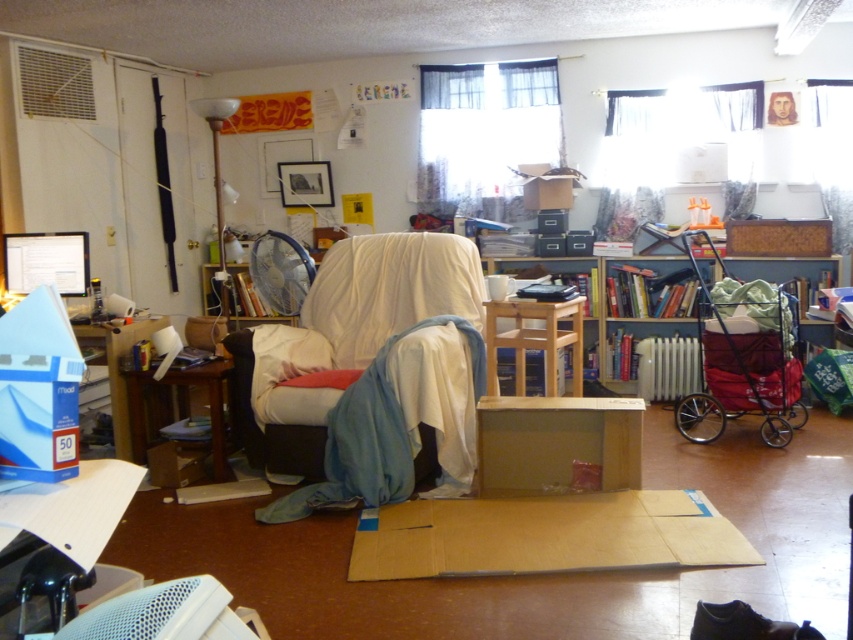
Question: Does brown cardboard box at center have a smaller size compared to brown wood side table at left?

Choices:
 (A) no
 (B) yes

Answer: (A)

Question: Is wooden chair at center closer to the viewer compared to brown wood side table at left?

Choices:
 (A) no
 (B) yes

Answer: (B)

Question: Estimate the real-world distances between objects in this image. Which object is farther from the wooden bookshelf at center?

Choices:
 (A) white fabric chair at center
 (B) wooden chair at center

Answer: (A)

Question: Is brown cardboard box at center thinner than white fabric chair at center?

Choices:
 (A) no
 (B) yes

Answer: (A)

Question: Among these objects, which one is farthest from the camera?

Choices:
 (A) brown cardboard box at center
 (B) brown wood side table at left

Answer: (B)

Question: Estimate the real-world distances between objects in this image. Which object is closer to the brown wood side table at left?

Choices:
 (A) wooden chair at center
 (B) brown cardboard box at center
 (C) wooden bookshelf at center

Answer: (B)